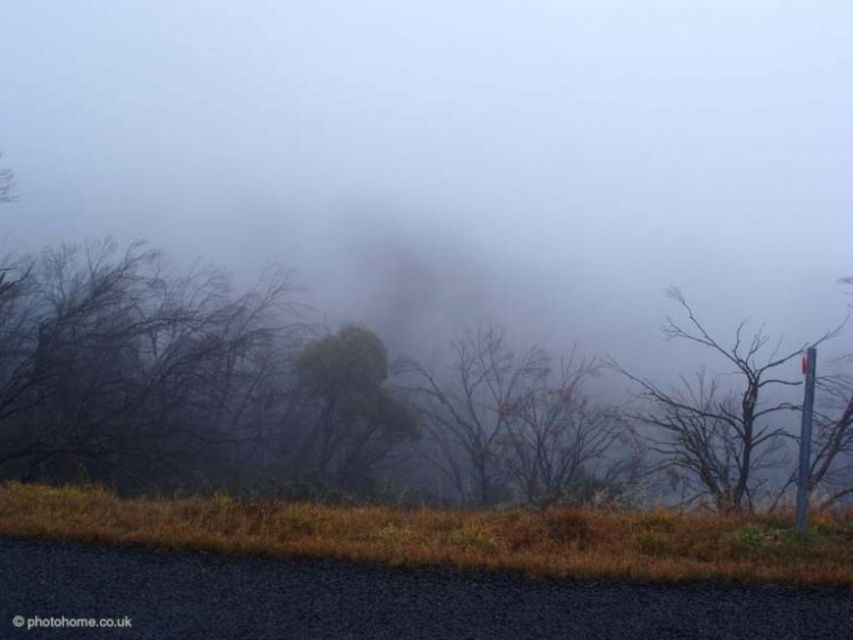
Does green matte tree at center come in front of metallic pole at right?

No, green matte tree at center is behind metallic pole at right.

Does green matte tree at center have a lesser width compared to metallic pole at right?

No, green matte tree at center is not thinner than metallic pole at right.

Is point (358, 358) positioned in front of point (799, 468)?

No, it is behind (799, 468).

This screenshot has height=640, width=853. In order to click on green matte tree at center in this screenshot , I will do `click(349, 406)`.

Which is in front, point (312, 397) or point (676, 291)?

Point (676, 291) is in front.

Between green matte tree at center and smooth gray pole at right, which one has more height?

With more height is smooth gray pole at right.

Image resolution: width=853 pixels, height=640 pixels. Identify the location of green matte tree at center. (349, 406).

Identify the location of green matte tree at center. The height and width of the screenshot is (640, 853). (349, 406).

Which is above, smooth gray pole at right or metallic pole at right?

smooth gray pole at right is higher up.

Is smooth gray pole at right bigger than metallic pole at right?

Indeed, smooth gray pole at right has a larger size compared to metallic pole at right.

Is point (764, 410) farther from camera compared to point (804, 476)?

Yes, point (764, 410) is farther from viewer.

The image size is (853, 640). In order to click on smooth gray pole at right in this screenshot , I will do `click(741, 390)`.